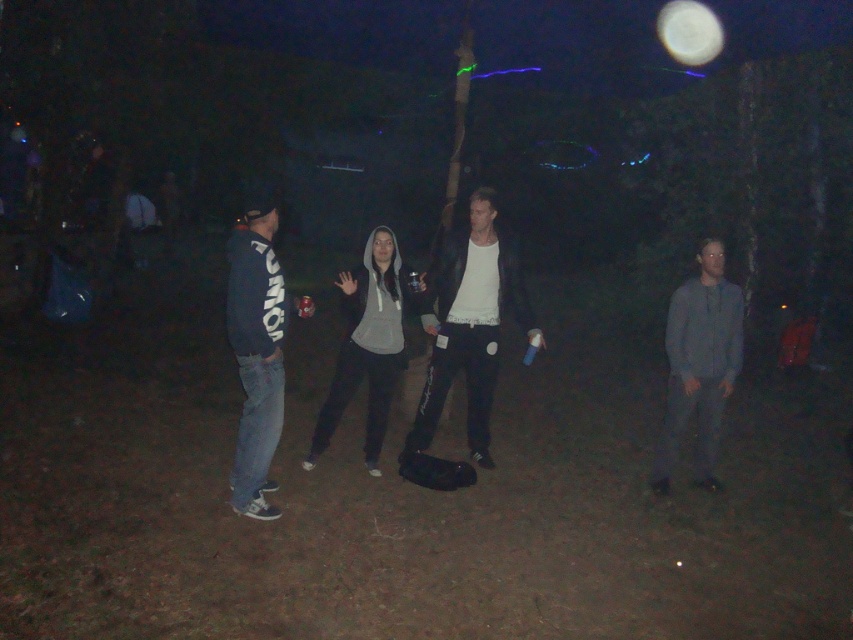
You are standing at the point marked as point (270,323) and want to throw a ball to someone across the group. If the distance between you and the farthest person in the group is 4.69 meters, can you reach them with a throw of 5 meters?

Yes, because the distance between you and the farthest person is 4.69 meters, which is within your 5 meter throwing range.

You are a photographer trying to capture a candid shot of the dark gray hoodie at center without including the gray cotton shirt at right in the frame. Is this possible given their positions?

The dark gray hoodie at center is behind the gray cotton shirt at right, so it would be difficult to capture the dark gray hoodie at center without the gray cotton shirt at right blocking part of the view. Adjust your angle or position to find a clear shot.